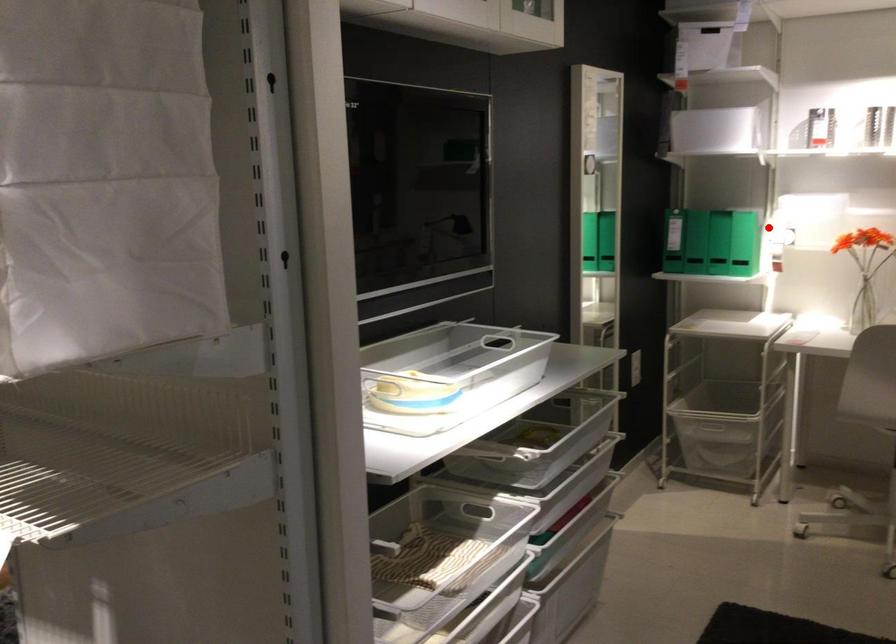
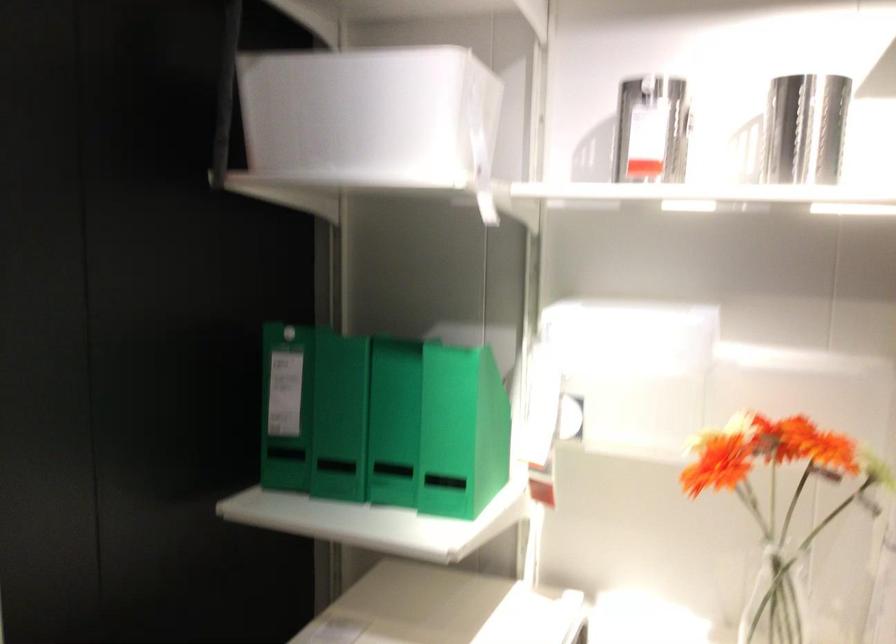
Question: I am providing you with two images of the same scene from different viewpoints. Image1 has a red point marked. In image2, the corresponding 3D location appears at what relative position? Reply with the corresponding letter.

Choices:
 (A) Closer
 (B) Farther

Answer: (A)